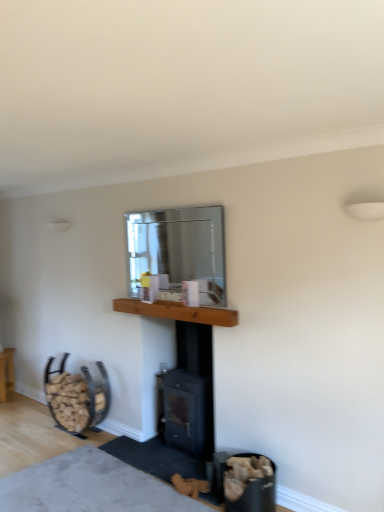
Question: Considering the relative sizes of wooden at left and clear glass mirror at upper center in the image provided, is wooden at left thinner than clear glass mirror at upper center?

Choices:
 (A) no
 (B) yes

Answer: (A)

Question: Considering the relative positions of wooden at left and clear glass mirror at upper center in the image provided, is wooden at left to the right of clear glass mirror at upper center from the viewer's perspective?

Choices:
 (A) yes
 (B) no

Answer: (B)

Question: Can you confirm if wooden at left is taller than clear glass mirror at upper center?

Choices:
 (A) yes
 (B) no

Answer: (B)

Question: Is wooden at left turned away from clear glass mirror at upper center?

Choices:
 (A) no
 (B) yes

Answer: (A)

Question: Is wooden at left positioned before clear glass mirror at upper center?

Choices:
 (A) yes
 (B) no

Answer: (B)

Question: Is wooden at left not inside clear glass mirror at upper center?

Choices:
 (A) yes
 (B) no

Answer: (A)

Question: From a real-world perspective, is black matte wood burning stove at center positioned under wooden mantle at center based on gravity?

Choices:
 (A) no
 (B) yes

Answer: (B)

Question: Can you confirm if black matte wood burning stove at center is smaller than wooden mantle at center?

Choices:
 (A) no
 (B) yes

Answer: (A)

Question: Considering the relative sizes of black matte wood burning stove at center and wooden mantle at center in the image provided, is black matte wood burning stove at center shorter than wooden mantle at center?

Choices:
 (A) yes
 (B) no

Answer: (B)

Question: Could you tell me if black matte wood burning stove at center is turned towards wooden mantle at center?

Choices:
 (A) no
 (B) yes

Answer: (A)

Question: From the image's perspective, would you say black matte wood burning stove at center is positioned over wooden mantle at center?

Choices:
 (A) no
 (B) yes

Answer: (A)

Question: Is black matte wood burning stove at center in front of wooden mantle at center?

Choices:
 (A) yes
 (B) no

Answer: (B)

Question: Does clear glass mirror at upper center have a greater width compared to soft gray carpet at lower center?

Choices:
 (A) no
 (B) yes

Answer: (A)